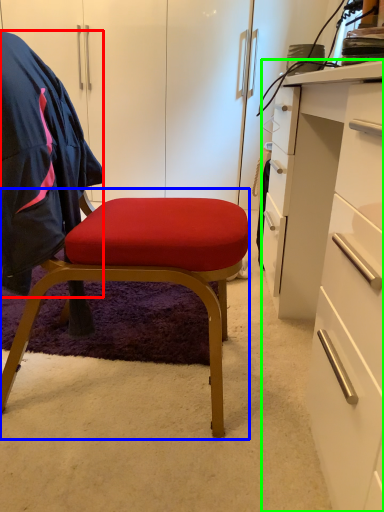
Question: Which is farther away from clothing (highlighted by a red box)? chair (highlighted by a blue box) or desk (highlighted by a green box)?

Choices:
 (A) chair
 (B) desk

Answer: (B)